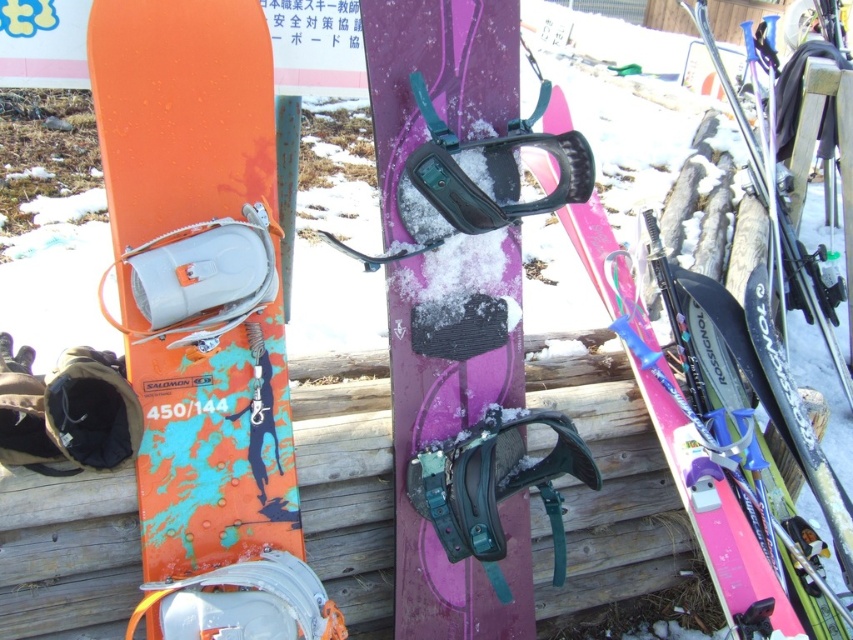
From the picture: You are a snowboarder preparing to ride and notice the pink matte snowboard at center and the black matte goggles at center. Which item is located lower in the scene?

The pink matte snowboard at center is positioned under the black matte goggles at center, so it is located lower in the scene.

You are a ski equipment technician and need to store the pink matte snowboard at center and the black matte goggles at center in a storage box. The box can only fit one of them. Which item should you prioritize placing in the box first based on their sizes?

The pink matte snowboard at center is larger in size than the black matte goggles at center, so you should prioritize placing the pink matte snowboard at center first as it requires more space.

You are a snowboarder preparing for a day on the slopes and notice both the purple matte snowboard at center and the green matte goggles at center. From your perspective, which item is located to the left?

The purple matte snowboard at center is positioned on the left side of the green matte goggles at center, so it is located to the left.